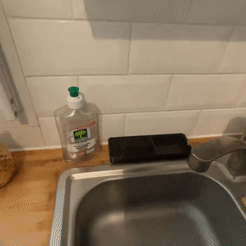
This screenshot has width=246, height=246. What are the coordinates of `white soap bar` in the screenshot? It's located at (185, 152).